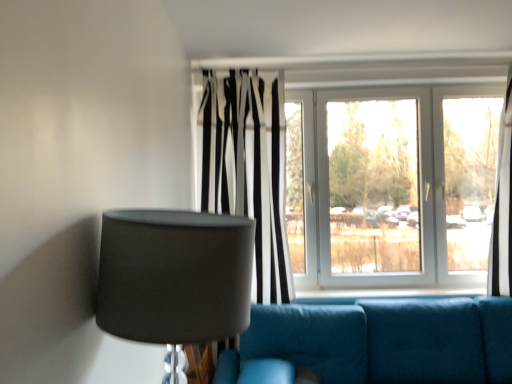
Question: Is white glossy window at center to the left of teal fabric couch at lower center from the viewer's perspective?

Choices:
 (A) yes
 (B) no

Answer: (B)

Question: Is white glossy window at center shorter than teal fabric couch at lower center?

Choices:
 (A) no
 (B) yes

Answer: (A)

Question: Is white glossy window at center facing away from teal fabric couch at lower center?

Choices:
 (A) yes
 (B) no

Answer: (B)

Question: Is white glossy window at center placed right next to teal fabric couch at lower center?

Choices:
 (A) yes
 (B) no

Answer: (B)

Question: Is white glossy window at center in front of teal fabric couch at lower center?

Choices:
 (A) no
 (B) yes

Answer: (A)

Question: From the image's perspective, is white glossy window at center above or below teal fabric couch at lower center?

Choices:
 (A) above
 (B) below

Answer: (A)

Question: Is point (310, 221) closer or farther from the camera than point (357, 309)?

Choices:
 (A) closer
 (B) farther

Answer: (B)

Question: Visually, is white glossy window at center positioned to the left or to the right of teal fabric couch at lower center?

Choices:
 (A) right
 (B) left

Answer: (A)

Question: Is white glossy window at center wider or thinner than teal fabric couch at lower center?

Choices:
 (A) wide
 (B) thin

Answer: (B)

Question: In terms of width, does matte gray lampshade at left look wider or thinner when compared to white glossy window at center?

Choices:
 (A) thin
 (B) wide

Answer: (B)

Question: Is matte gray lampshade at left taller or shorter than white glossy window at center?

Choices:
 (A) short
 (B) tall

Answer: (A)

Question: In the image, is matte gray lampshade at left positioned in front of or behind white glossy window at center?

Choices:
 (A) behind
 (B) front

Answer: (B)

Question: Is matte gray lampshade at left spatially inside white glossy window at center, or outside of it?

Choices:
 (A) inside
 (B) outside

Answer: (B)

Question: Considering the positions of teal fabric couch at lower center and white glossy window at center in the image, is teal fabric couch at lower center bigger or smaller than white glossy window at center?

Choices:
 (A) big
 (B) small

Answer: (A)

Question: Looking at their shapes, would you say teal fabric couch at lower center is wider or thinner than white glossy window at center?

Choices:
 (A) thin
 (B) wide

Answer: (B)